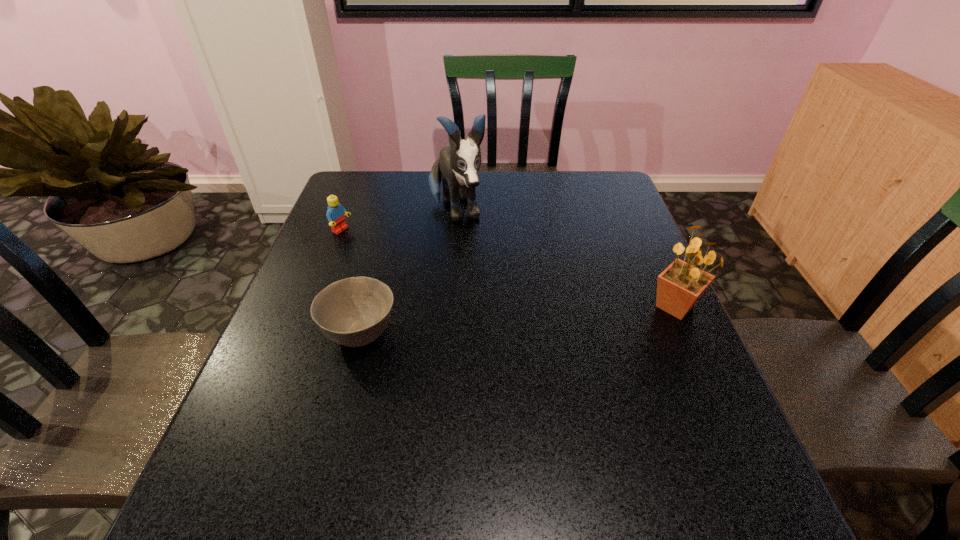
Locate an element on the screen. The height and width of the screenshot is (540, 960). bowl is located at coordinates (353, 312).

You are a GUI agent. You are given a task and a screenshot of the screen. Output one action in this format:
    pyautogui.click(x=<x>, y=<y>)
    Task: Click on the rightmost object
    The height and width of the screenshot is (540, 960).
    Given the screenshot: What is the action you would take?
    pyautogui.click(x=681, y=284)

This screenshot has width=960, height=540. Find the location of `sunflower`. sunflower is located at coordinates (681, 284).

Identify the location of Lego. This screenshot has width=960, height=540. (335, 214).

The width and height of the screenshot is (960, 540). I want to click on puppy, so click(458, 165).

At what (x,y) coordinates should I click in order to perform the action: click on the third object from left to right. Please return your answer as a coordinate pair (x, y). The height and width of the screenshot is (540, 960). Looking at the image, I should click on (458, 165).

This screenshot has width=960, height=540. I want to click on blank area located on the right of the bowl, so click(539, 334).

Where is `vacant point located 0.160m at the front of the second tallest object with flowers visible`? This screenshot has height=540, width=960. vacant point located 0.160m at the front of the second tallest object with flowers visible is located at coordinates (711, 387).

Find the location of a particular element. Image resolution: width=960 pixels, height=540 pixels. blank area located on the face of the Lego is located at coordinates (367, 243).

Where is `vacant space located on the face of the Lego`? The height and width of the screenshot is (540, 960). vacant space located on the face of the Lego is located at coordinates (391, 254).